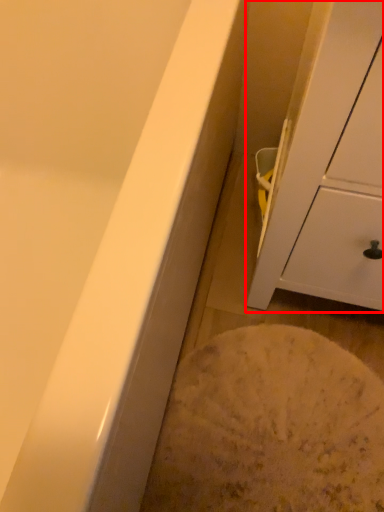
Question: From the image's perspective, where is cabinetry (annotated by the red box) located in relation to flour in the image?

Choices:
 (A) above
 (B) below

Answer: (A)